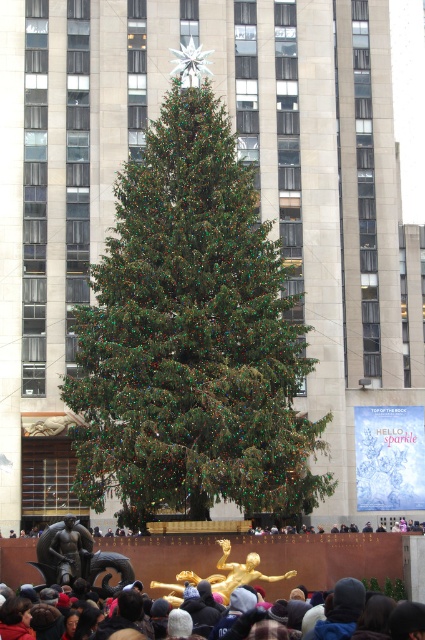
Which is below, green matte christmas tree at center or dark gray knit hats at lower center?

dark gray knit hats at lower center is lower down.

You are a GUI agent. You are given a task and a screenshot of the screen. Output one action in this format:
    pyautogui.click(x=<x>, y=<y>)
    Task: Click on the green matte christmas tree at center
    The image size is (425, 640).
    Given the screenshot: What is the action you would take?
    pyautogui.click(x=192, y=333)

Which is in front, point (195, 474) or point (246, 618)?

Point (246, 618)

Where is `green matte christmas tree at center`? green matte christmas tree at center is located at coordinates (192, 333).